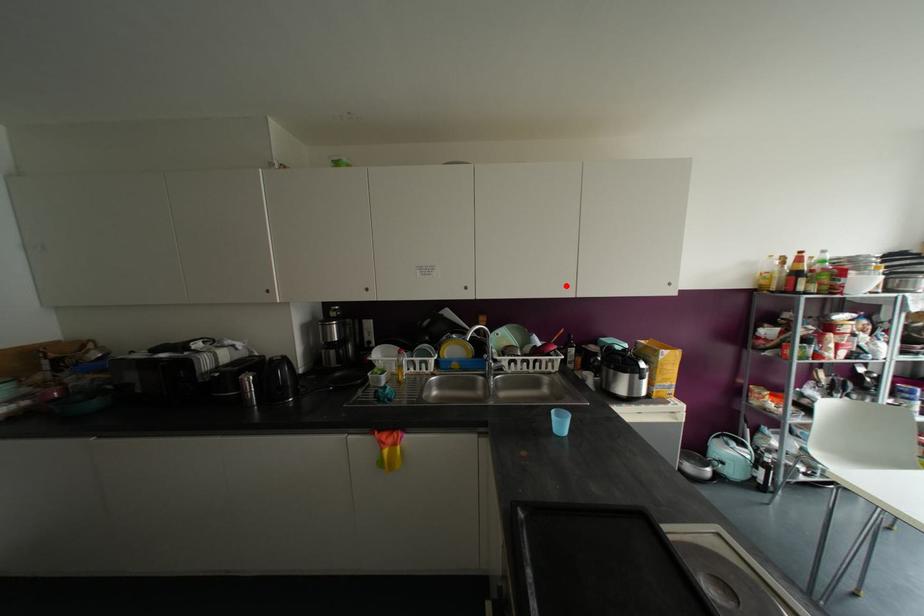
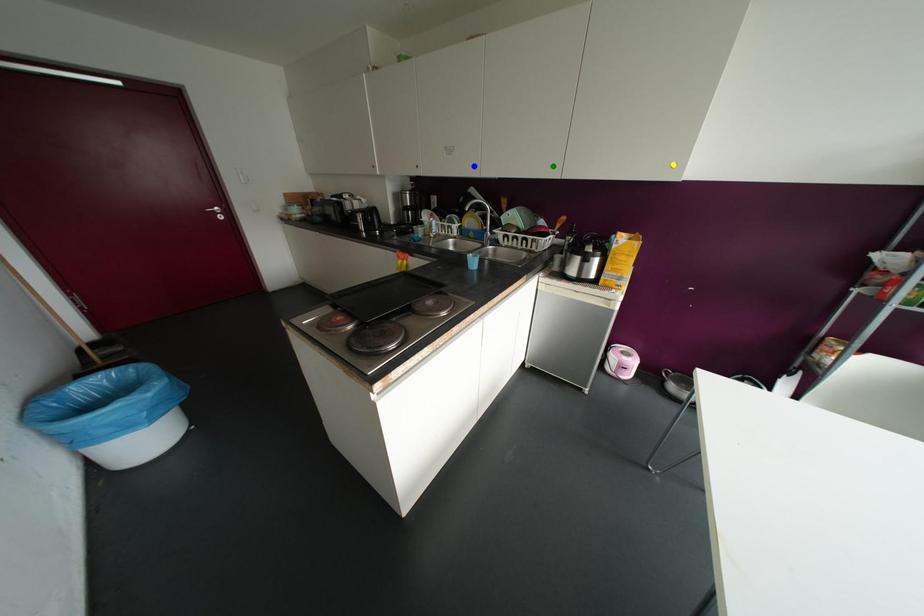
Question: I am providing you with two images of the same scene from different viewpoints. A red point is marked on the first image. You are given multiple points on the second image. Which spot in image 2 lines up with the point in image 1?

Choices:
 (A) blue point
 (B) yellow point
 (C) green point

Answer: (C)